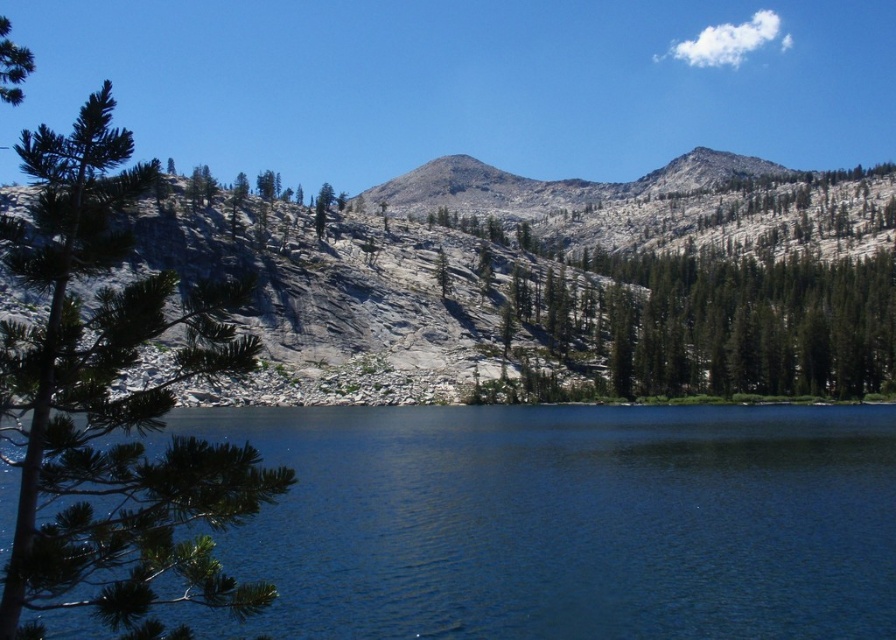
Is the position of blue glassy water at center more distant than that of green matte tree at left?

That is True.

Measure the distance between blue glassy water at center and green matte tree at left.

blue glassy water at center is 25.41 meters from green matte tree at left.

Does point (524, 525) lie behind point (73, 307)?

That is True.

Where is `blue glassy water at center`? blue glassy water at center is located at coordinates (565, 522).

Locate an element on the screen. Image resolution: width=896 pixels, height=640 pixels. blue glassy water at center is located at coordinates (565, 522).

Does blue glassy water at center come in front of gray rocky mountain at center?

That is True.

The image size is (896, 640). Describe the element at coordinates (565, 522) in the screenshot. I see `blue glassy water at center` at that location.

You are a GUI agent. You are given a task and a screenshot of the screen. Output one action in this format:
    pyautogui.click(x=<x>, y=<y>)
    Task: Click on the blue glassy water at center
    The image size is (896, 640).
    Given the screenshot: What is the action you would take?
    pyautogui.click(x=565, y=522)

From the picture: Between green matte tree at left and gray rocky mountain at center, which one is positioned higher?

Positioned higher is gray rocky mountain at center.

This screenshot has height=640, width=896. Find the location of `green matte tree at left`. green matte tree at left is located at coordinates (114, 403).

Find the location of `green matte tree at left`. green matte tree at left is located at coordinates pyautogui.click(x=114, y=403).